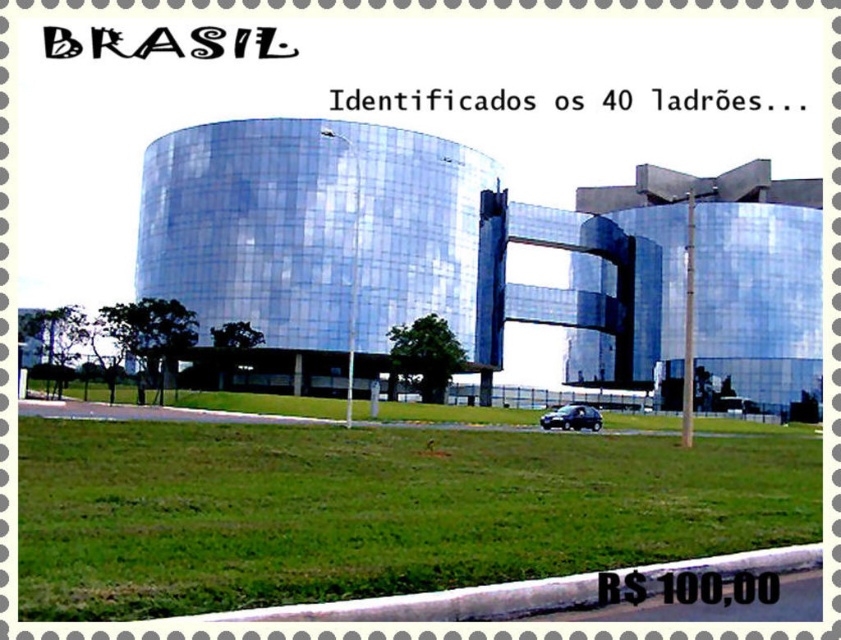
Question: Which of the following is the farthest from the observer?

Choices:
 (A) pos(442,529)
 (B) pos(543,420)

Answer: (B)

Question: Does green grass at lower center have a greater width compared to shiny black car at lower center?

Choices:
 (A) yes
 (B) no

Answer: (A)

Question: Is green grass at lower center above shiny black car at lower center?

Choices:
 (A) no
 (B) yes

Answer: (B)

Question: Does green grass at lower center have a larger size compared to shiny black car at lower center?

Choices:
 (A) yes
 (B) no

Answer: (B)